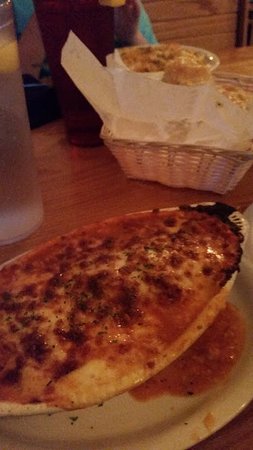
Where is `plate`? The width and height of the screenshot is (253, 450). plate is located at coordinates click(x=123, y=410).